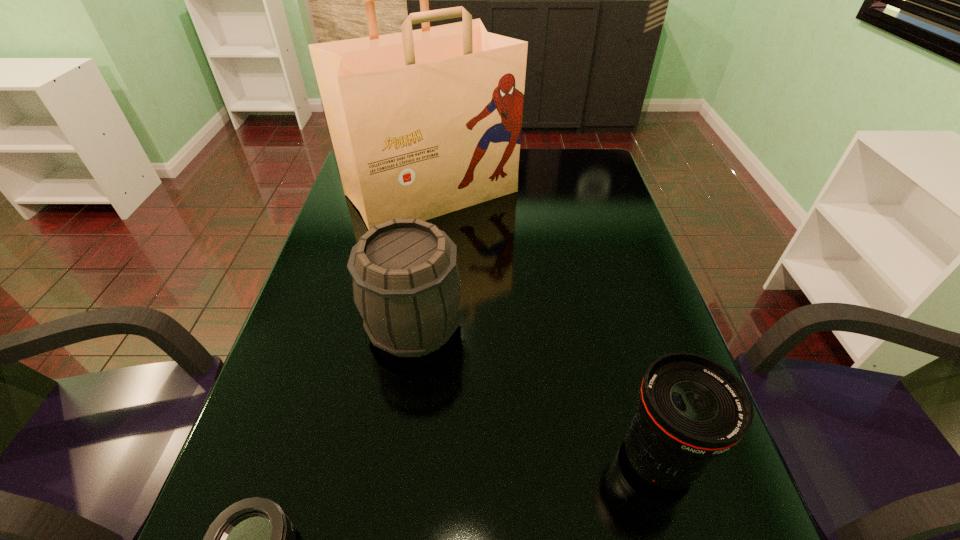
In order to click on object present at the right edge in this screenshot , I will do `click(691, 409)`.

I want to click on object situated at the far left corner, so click(x=425, y=122).

This screenshot has width=960, height=540. Find the location of `vacant space at the far edge of the desktop`. vacant space at the far edge of the desktop is located at coordinates (540, 173).

This screenshot has height=540, width=960. In the image, there is a desktop. Find the location of `vacant area at the left edge`. vacant area at the left edge is located at coordinates (334, 433).

Find the location of a particular element. vacant region at the right edge of the desktop is located at coordinates (723, 503).

Where is `vacant space at the far right corner of the desktop`? vacant space at the far right corner of the desktop is located at coordinates (562, 170).

Find the location of a particular element. Image resolution: width=960 pixels, height=540 pixels. free spot between the wine bucket and the farther telephoto lens is located at coordinates (537, 393).

The width and height of the screenshot is (960, 540). Identify the location of free space between the farther telephoto lens and the farthest object. (545, 326).

Locate an element on the screen. This screenshot has height=540, width=960. vacant area that lies between the rightmost object and the wine bucket is located at coordinates (537, 393).

Select which object appears as the third closest to the tallest object. Please provide its 2D coordinates. Your answer should be formatted as a tuple, i.e. [(x, y)], where the tuple contains the x and y coordinates of a point satisfying the conditions above.

[(253, 539)]